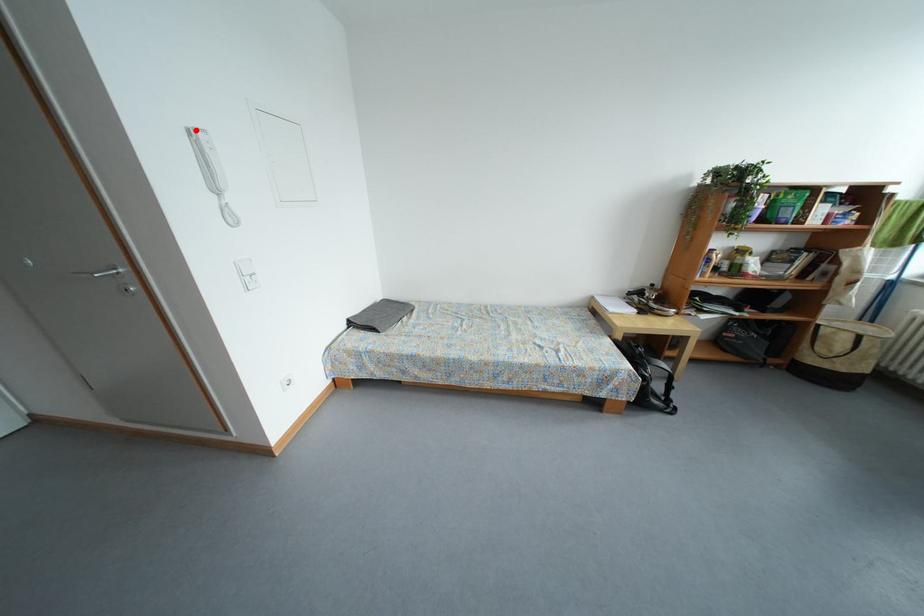
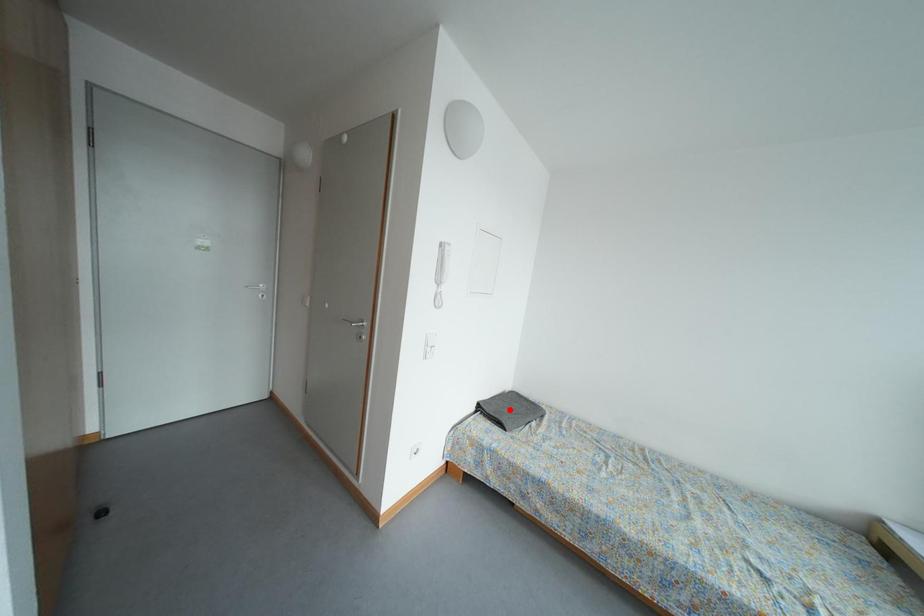
I am providing you with two images of the same scene from different viewpoints. A red point is marked on the first image and another point is marked on the second image. Are the points marked in image1 and image2 representing the same 3D position?

No